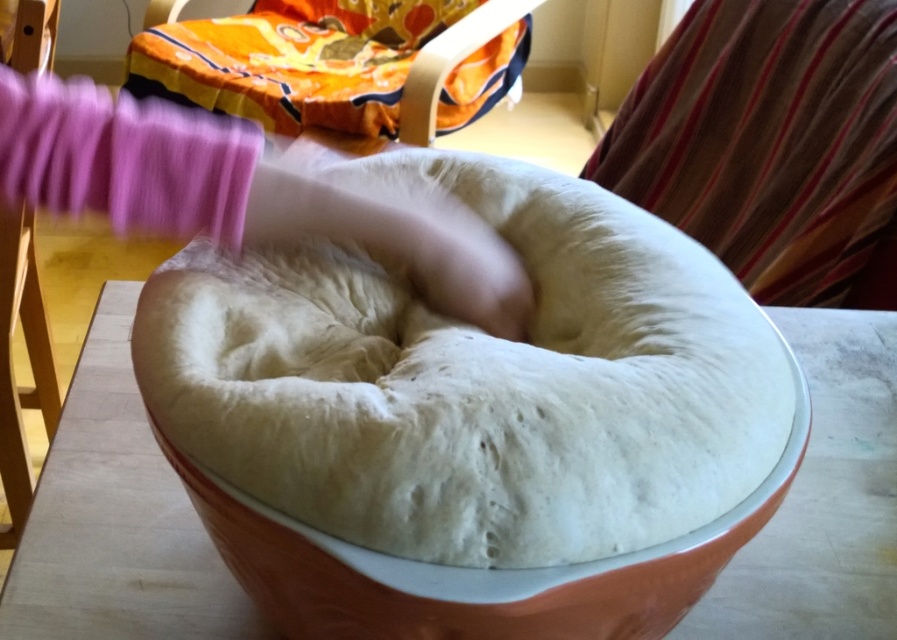
Question: Estimate the real-world distances between objects in this image. Which object is farther from the orange fabric cushion at upper left?

Choices:
 (A) white dough at center
 (B) white glossy bowl at center

Answer: (B)

Question: Does white dough at center have a smaller size compared to orange fabric cushion at upper left?

Choices:
 (A) yes
 (B) no

Answer: (A)

Question: Is white dough at center positioned in front of orange fabric cushion at upper left?

Choices:
 (A) yes
 (B) no

Answer: (A)

Question: Among these objects, which one is nearest to the camera?

Choices:
 (A) orange fabric cushion at upper left
 (B) white dough at center

Answer: (B)

Question: Which point is farther to the camera?

Choices:
 (A) orange fabric cushion at upper left
 (B) white dough at center

Answer: (A)

Question: Can you confirm if white glossy bowl at center is thinner than orange fabric cushion at upper left?

Choices:
 (A) yes
 (B) no

Answer: (A)